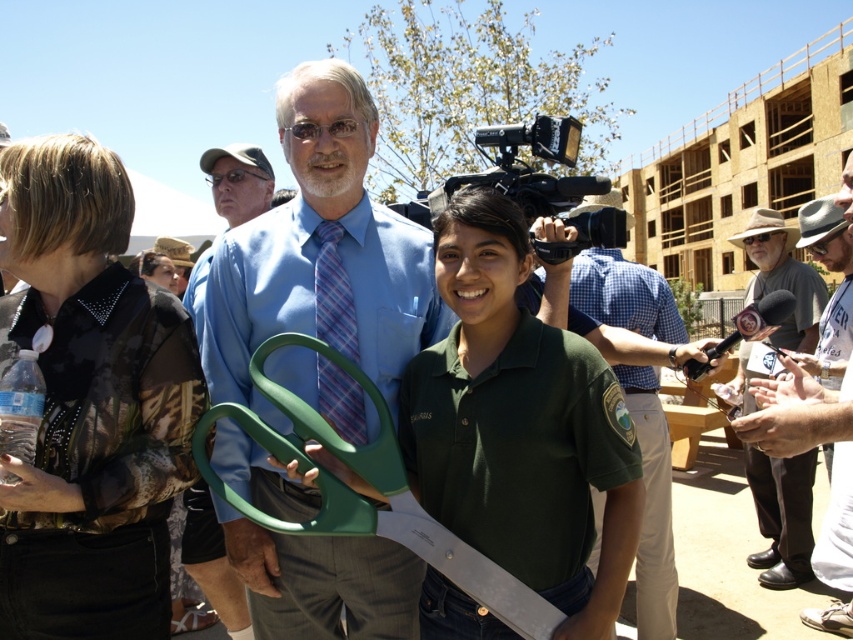
Which is behind, point (86, 291) or point (844, 518)?

Point (86, 291)

How much distance is there between camouflage shirt at left and gray felt hat at right?

2.21 meters

Image resolution: width=853 pixels, height=640 pixels. Identify the location of camouflage shirt at left. (90, 403).

Does camouflage shirt at left have a greater height compared to blue fabric shirt at upper center?

Yes, camouflage shirt at left is taller than blue fabric shirt at upper center.

Who is higher up, camouflage shirt at left or blue fabric shirt at upper center?

Positioned higher is camouflage shirt at left.

Is point (117, 337) closer to camera compared to point (236, 624)?

Yes, it is in front of point (236, 624).

The width and height of the screenshot is (853, 640). Identify the location of camouflage shirt at left. (90, 403).

Does camouflage shirt at left appear over blue shirt at center?

Correct, camouflage shirt at left is located above blue shirt at center.

Does point (56, 579) come behind point (579, 288)?

That is False.

The width and height of the screenshot is (853, 640). What are the coordinates of `camouflage shirt at left` in the screenshot? It's located at (90, 403).

You are a GUI agent. You are given a task and a screenshot of the screen. Output one action in this format:
    pyautogui.click(x=<x>, y=<y>)
    Task: Click on the camouflage shirt at left
    
    Given the screenshot: What is the action you would take?
    pyautogui.click(x=90, y=403)